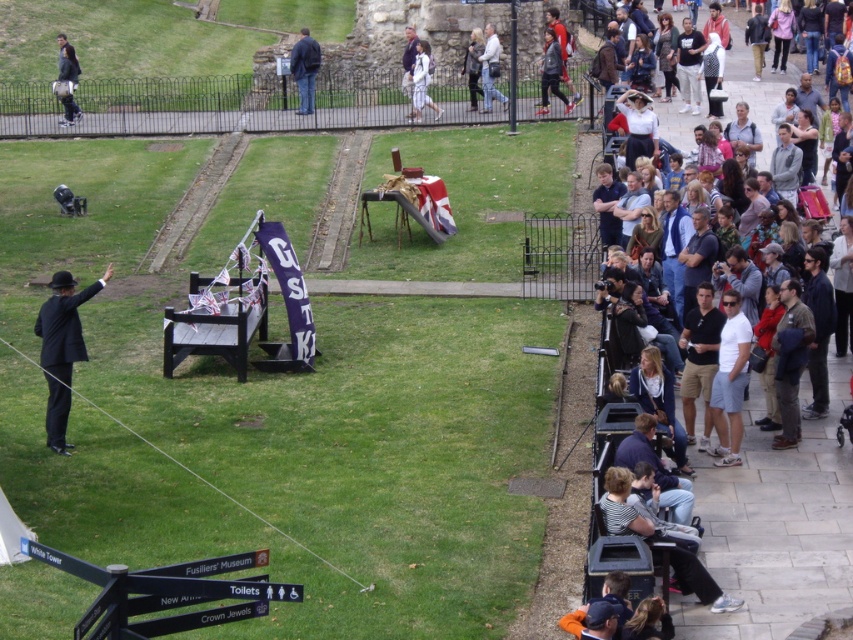
Question: Can you confirm if white cotton dress at center is positioned to the left of light brown leather jacket at upper right?

Choices:
 (A) no
 (B) yes

Answer: (B)

Question: Which object is farther from the camera taking this photo?

Choices:
 (A) black matte suit at left
 (B) light blue jeans at center

Answer: (B)

Question: Can you confirm if dark blue jeans at center is bigger than light brown leather jacket at upper right?

Choices:
 (A) no
 (B) yes

Answer: (B)

Question: Which object is closer to the camera taking this photo?

Choices:
 (A) white cotton dress at center
 (B) light blue jeans at center
 (C) dark blue jeans at center

Answer: (A)

Question: Does white cotton dress at center appear on the right side of light blue jeans at center?

Choices:
 (A) yes
 (B) no

Answer: (B)

Question: Considering the real-world distances, which object is closest to the white cotton dress at center?

Choices:
 (A) gray sweatshirt at right
 (B) light blue jeans at center

Answer: (B)